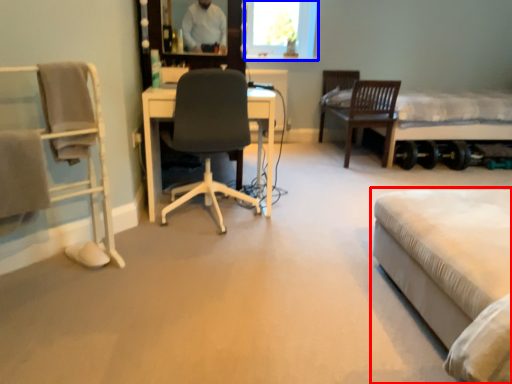
Question: Which of the following is the closest to the observer, bed (highlighted by a red box) or window screen (highlighted by a blue box)?

Choices:
 (A) bed
 (B) window screen

Answer: (A)